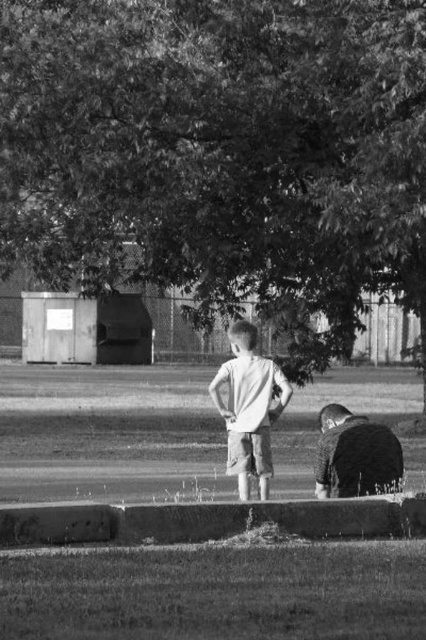
Question: Which point is farther to the camera?

Choices:
 (A) dark green leafy tree at center
 (B) white matte shirt at center
 (C) dark fabric stroller at lower right

Answer: (A)

Question: Among these objects, which one is nearest to the camera?

Choices:
 (A) dark fabric stroller at lower right
 (B) concrete curb at lower center
 (C) white matte shirt at center
 (D) dark green leafy tree at center

Answer: (B)

Question: Which point appears farthest from the camera in this image?

Choices:
 (A) (146, 518)
 (B) (239, 356)
 (C) (377, 449)
 (D) (189, 168)

Answer: (D)

Question: Does concrete curb at lower center have a greater width compared to white matte shirt at center?

Choices:
 (A) yes
 (B) no

Answer: (A)

Question: Does white matte shirt at center appear on the right side of dark fabric stroller at lower right?

Choices:
 (A) no
 (B) yes

Answer: (A)

Question: Does concrete curb at lower center appear over white matte shirt at center?

Choices:
 (A) yes
 (B) no

Answer: (B)